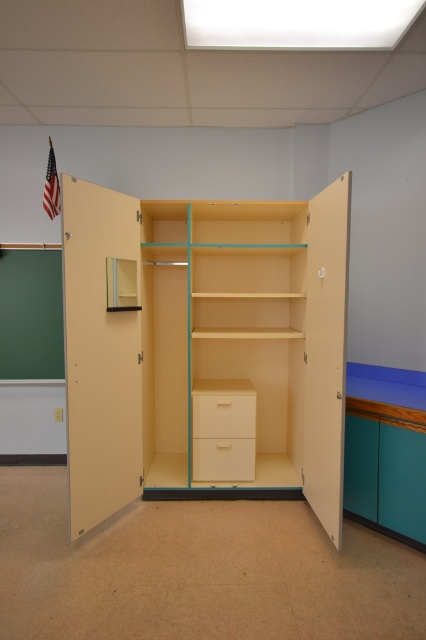
Question: Which of the following is the farthest from the observer?

Choices:
 (A) (48, 326)
 (B) (227, 420)
 (C) (229, 461)

Answer: (A)

Question: Can you confirm if matte white drawer at center is positioned to the left of matte wood drawer at center?

Choices:
 (A) yes
 (B) no

Answer: (B)

Question: Is matte white drawer at center smaller than matte wood drawer at center?

Choices:
 (A) yes
 (B) no

Answer: (B)

Question: Based on their relative distances, which object is farther from the matte white drawer at center?

Choices:
 (A) green matte chalkboard at left
 (B) matte cream drawer at center

Answer: (A)

Question: Where is matte yellow cabinet at center located in relation to matte wood drawer at center in the image?

Choices:
 (A) right
 (B) left

Answer: (B)

Question: Among these objects, which one is farthest from the camera?

Choices:
 (A) green matte chalkboard at left
 (B) matte white drawer at center

Answer: (A)